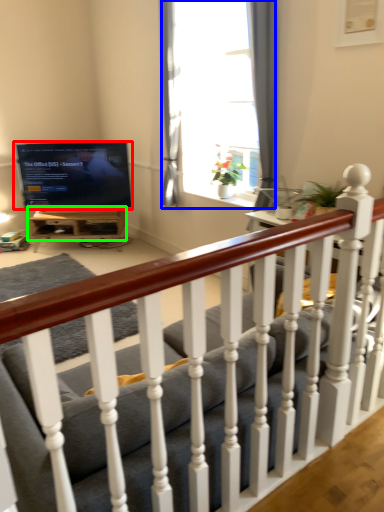
Question: Considering the real-world distances, which object is closest to television (highlighted by a red box)? window (highlighted by a blue box) or table (highlighted by a green box).

Choices:
 (A) window
 (B) table

Answer: (B)